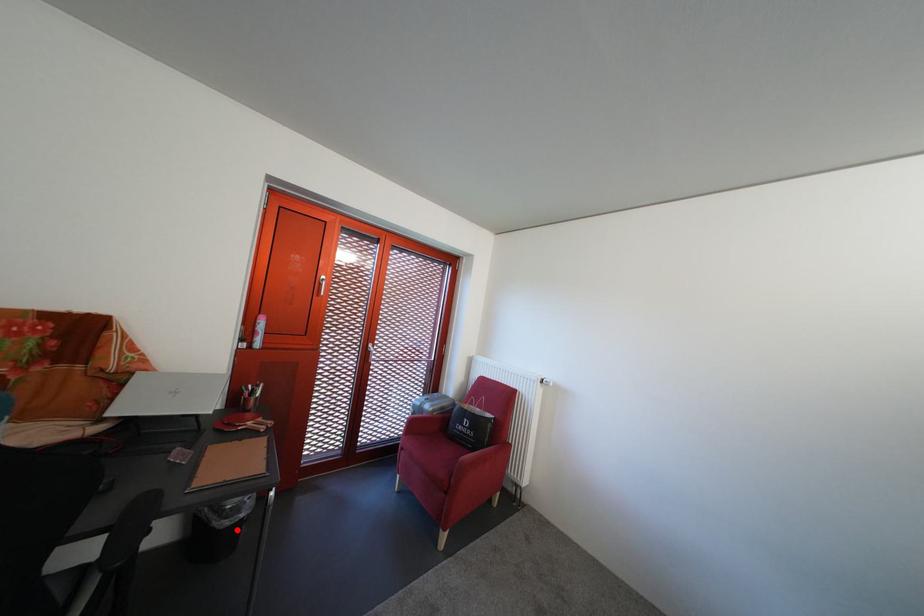
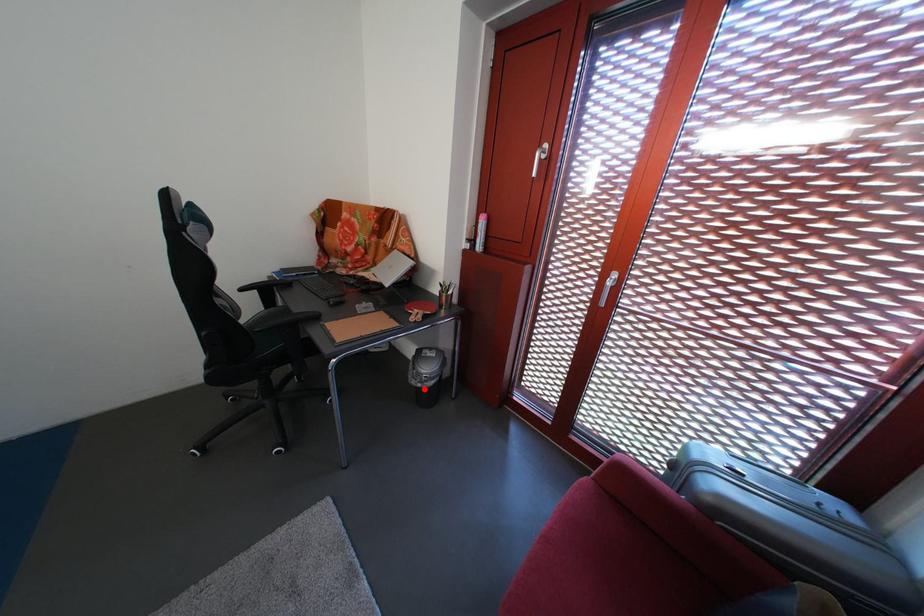
I am providing you with two images of the same scene from different viewpoints. A red point is marked on the first image and another point is marked on the second image. Are the points marked in image1 and image2 representing the same 3D position?

Yes